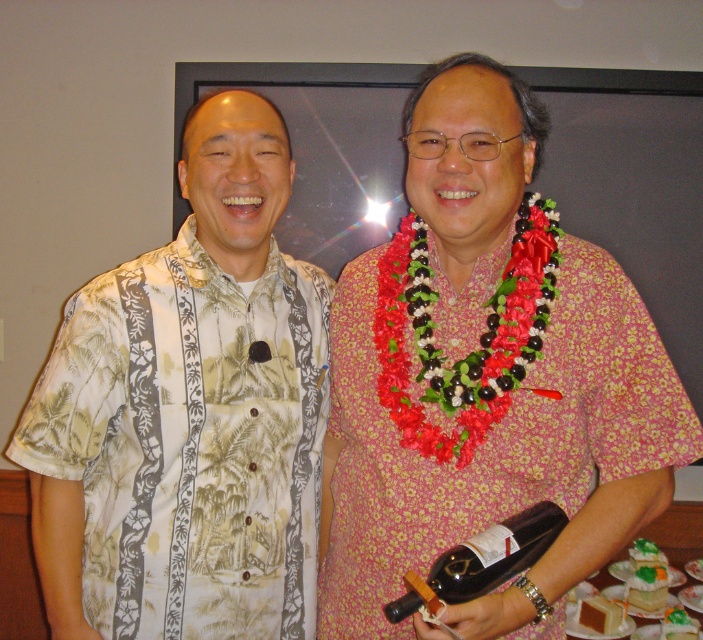
Question: Is white floral shirt at left below black glass bottle at lower center?

Choices:
 (A) no
 (B) yes

Answer: (A)

Question: Which object is farther from the camera taking this photo?

Choices:
 (A) black glass bottle at lower center
 (B) white floral shirt at left

Answer: (B)

Question: Can you confirm if white floral shirt at left is smaller than black glass bottle at lower center?

Choices:
 (A) yes
 (B) no

Answer: (B)

Question: Does white floral shirt at left have a larger size compared to black glass bottle at lower center?

Choices:
 (A) yes
 (B) no

Answer: (A)

Question: Which of the following is the closest to the observer?

Choices:
 (A) (453, 598)
 (B) (20, 419)

Answer: (A)